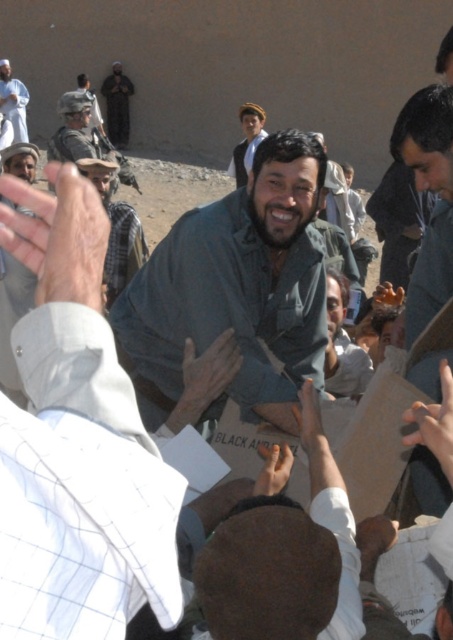
Question: Estimate the real-world distances between objects in this image. Which object is closer to the gray fabric shirt at center?

Choices:
 (A) dark gray shirt at center
 (B) light brown fabric hat at upper center
 (C) dark gray uniform at upper left

Answer: (A)

Question: In this image, where is brown felt hat at lower center located relative to light brown fabric hat at upper center?

Choices:
 (A) left
 (B) right

Answer: (B)

Question: Among these objects, which one is nearest to the camera?

Choices:
 (A) gray fabric shirt at center
 (B) dark gray shirt at center

Answer: (B)

Question: Is dark gray shirt at center closer to camera compared to brown felt hat at lower center?

Choices:
 (A) yes
 (B) no

Answer: (B)

Question: Which object is positioned closest to the gray fabric shirt at center?

Choices:
 (A) dark gray shirt at center
 (B) white cotton shirt at upper left
 (C) dark gray uniform at upper left
 (D) brown felt hat at lower center

Answer: (A)

Question: Considering the relative positions of brown felt hat at lower center and light brown fabric hat at upper center in the image provided, where is brown felt hat at lower center located with respect to light brown fabric hat at upper center?

Choices:
 (A) above
 (B) below

Answer: (B)